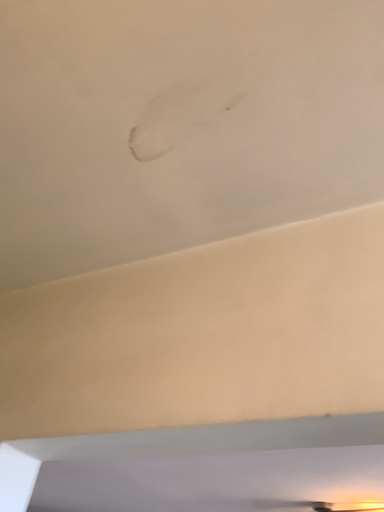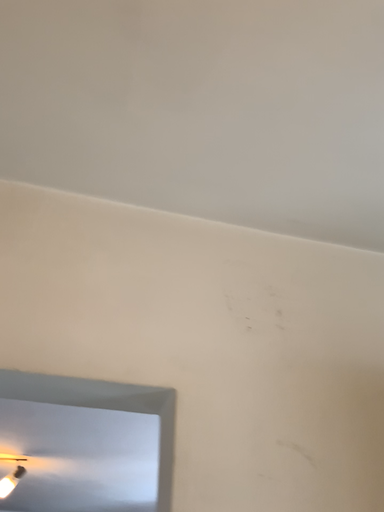
Question: Which way did the camera rotate in the video?

Choices:
 (A) rotated right
 (B) rotated left

Answer: (A)